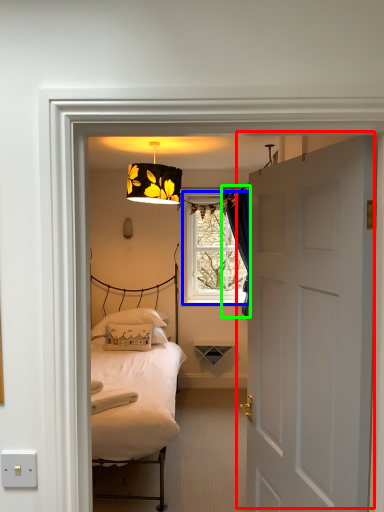
Question: Which is nearer to the door (highlighted by a red box)? window (highlighted by a blue box) or curtain (highlighted by a green box).

Choices:
 (A) window
 (B) curtain

Answer: (B)